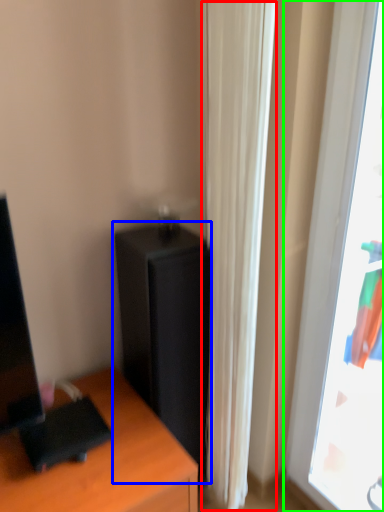
Question: Considering the real-world distances, which object is closest to curtain (highlighted by a red box)? file cabinet (highlighted by a blue box) or window (highlighted by a green box).

Choices:
 (A) file cabinet
 (B) window

Answer: (A)